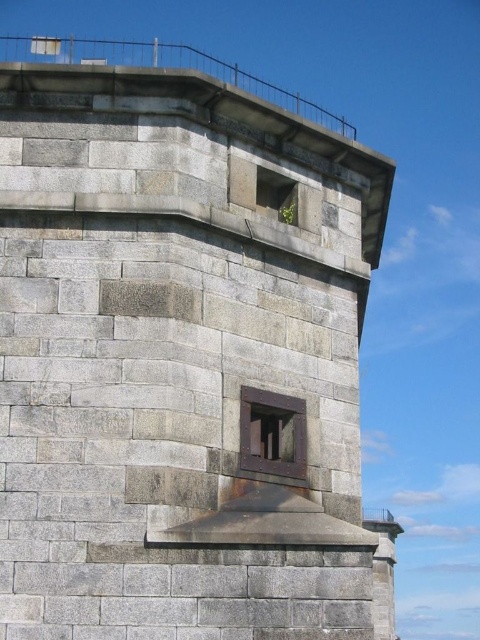
Does rusty metal window at center have a smaller size compared to rusty metal window at upper center?

No, rusty metal window at center is not smaller than rusty metal window at upper center.

Can you confirm if rusty metal window at center is positioned to the left of rusty metal window at upper center?

Yes, rusty metal window at center is to the left of rusty metal window at upper center.

Does point (245, 422) lie behind point (290, 182)?

No, (245, 422) is closer to viewer.

What are the coordinates of `rusty metal window at center` in the screenshot? It's located at (273, 433).